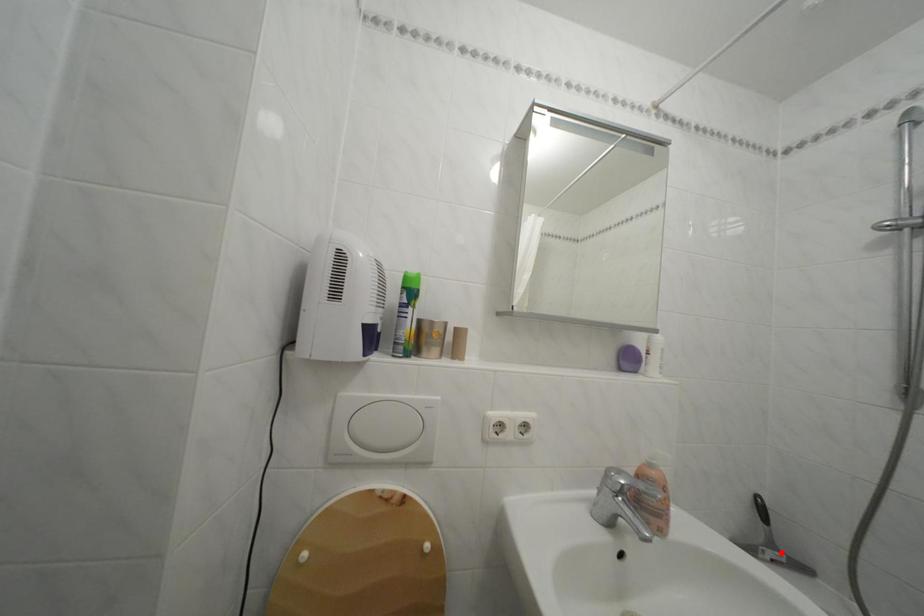
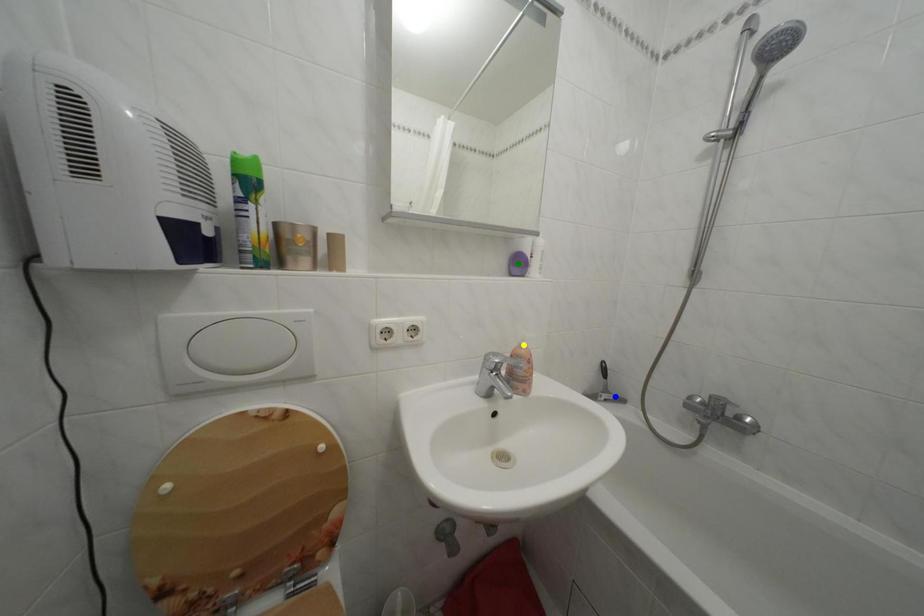
Question: I am providing you with two images of the same scene from different viewpoints. A red point is marked on the first image. You are given multiple points on the second image. In image 2, which mark is for the same physical point as the one in image 1?

Choices:
 (A) blue point
 (B) green point
 (C) yellow point

Answer: (A)